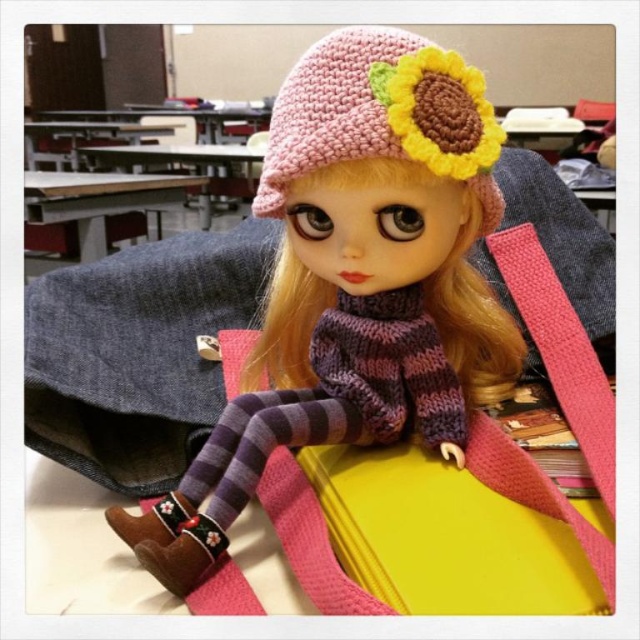
Question: Can you confirm if knitted pink hat at upper center is thinner than pink knitted hat at upper center?

Choices:
 (A) no
 (B) yes

Answer: (A)

Question: Which object is closer to the camera taking this photo?

Choices:
 (A) pink knitted hat at upper center
 (B) knitted pink hat at upper center

Answer: (B)

Question: Can you confirm if knitted pink hat at upper center is positioned to the left of pink knitted hat at upper center?

Choices:
 (A) yes
 (B) no

Answer: (A)

Question: Which point is closer to the camera?

Choices:
 (A) pink knitted hat at upper center
 (B) knitted pink hat at upper center

Answer: (B)

Question: Where is knitted pink hat at upper center located in relation to pink knitted hat at upper center in the image?

Choices:
 (A) left
 (B) right

Answer: (A)